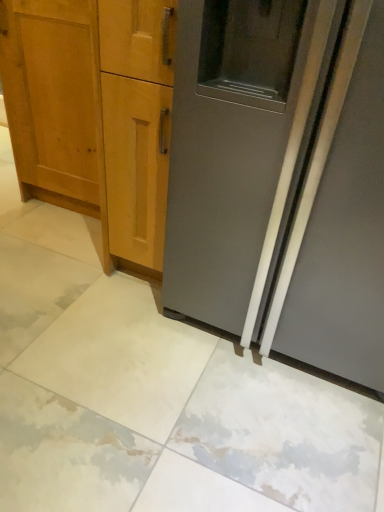
Question: Is satin gray refrigerator at right to the left or to the right of light brown wood cabinet at left in the image?

Choices:
 (A) right
 (B) left

Answer: (A)

Question: From their relative heights in the image, would you say satin gray refrigerator at right is taller or shorter than light brown wood cabinet at left?

Choices:
 (A) short
 (B) tall

Answer: (B)

Question: Considering their positions, is satin gray refrigerator at right located in front of or behind light brown wood cabinet at left?

Choices:
 (A) behind
 (B) front

Answer: (B)

Question: Is light brown wood cabinet at left to the left or to the right of satin gray refrigerator at right in the image?

Choices:
 (A) left
 (B) right

Answer: (A)

Question: Is light brown wood cabinet at left inside or outside of satin gray refrigerator at right?

Choices:
 (A) inside
 (B) outside

Answer: (B)

Question: Is light brown wood cabinet at left bigger or smaller than satin gray refrigerator at right?

Choices:
 (A) small
 (B) big

Answer: (A)

Question: From the image's perspective, is light brown wood cabinet at left located above or below satin gray refrigerator at right?

Choices:
 (A) above
 (B) below

Answer: (A)